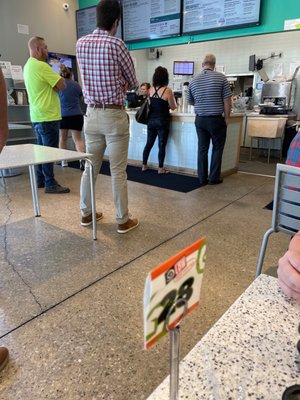
The height and width of the screenshot is (400, 300). Identify the location of blue wall. (280, 15).